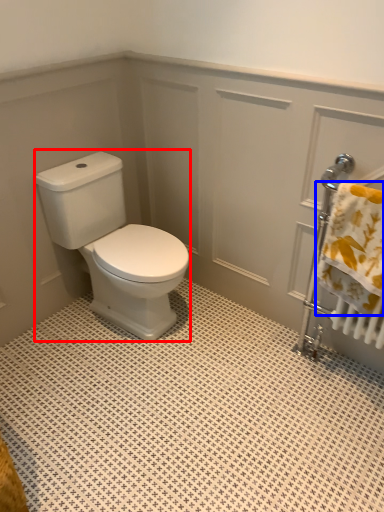
Question: Which object is further to the camera taking this photo, porcelain (highlighted by a red box) or bath towel (highlighted by a blue box)?

Choices:
 (A) porcelain
 (B) bath towel

Answer: (A)